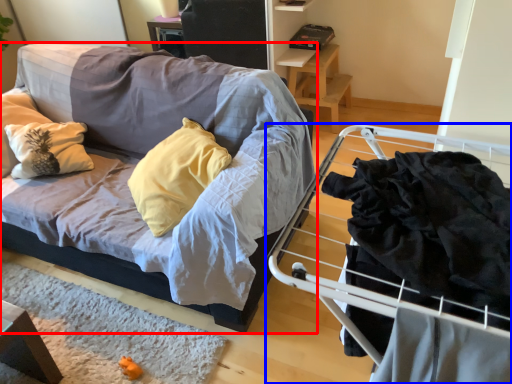
Question: Which object appears closest to the camera in this image, studio couch (highlighted by a red box) or furniture (highlighted by a blue box)?

Choices:
 (A) studio couch
 (B) furniture

Answer: (B)